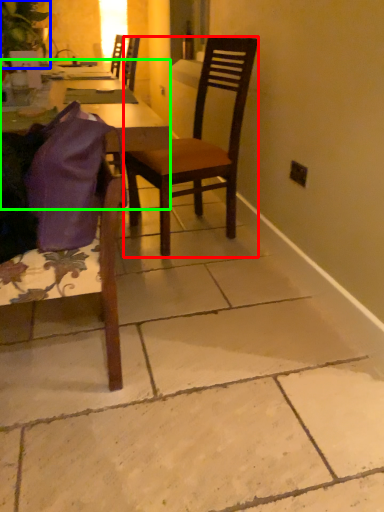
Question: Which object is the farthest from chair (highlighted by a red box)? Choose among these: houseplant (highlighted by a blue box) or desk (highlighted by a green box).

Choices:
 (A) houseplant
 (B) desk

Answer: (A)